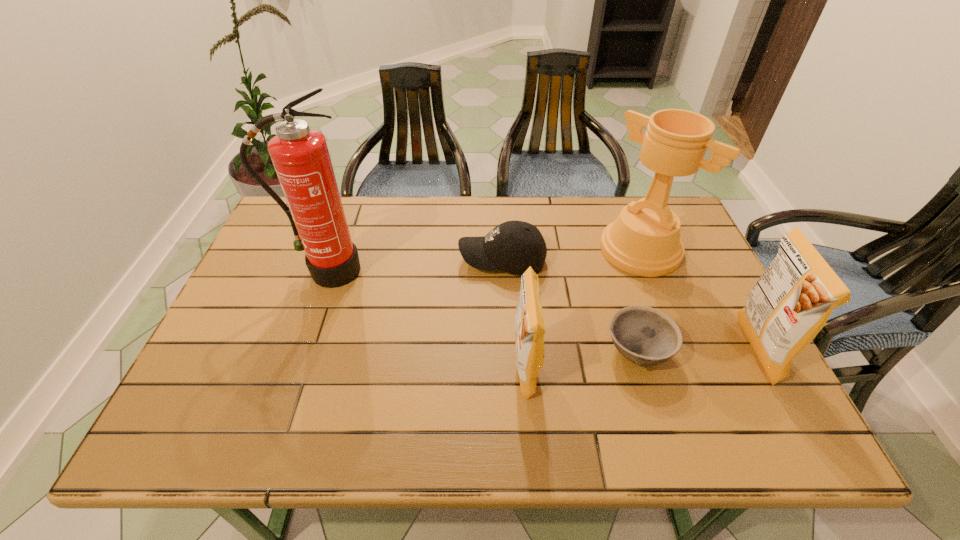
Given the evenly spaced crisp (potato chip)s in the image, where should an extra crisp (potato chip) be added on the left to preserve the spacing? Please point to a vacant space. Please provide its 2D coordinates. Your answer should be formatted as a tuple, i.e. [(x, y)], where the tuple contains the x and y coordinates of a point satisfying the conditions above.

[(277, 389)]